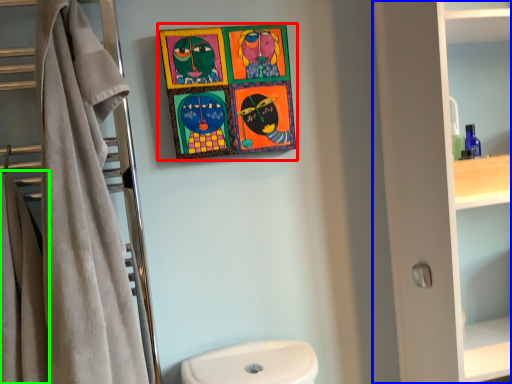
Question: Which object is the closest to the picture frame (highlighted by a red box)? Choose among these: bathroom cabinet (highlighted by a blue box) or bath towel (highlighted by a green box).

Choices:
 (A) bathroom cabinet
 (B) bath towel

Answer: (A)